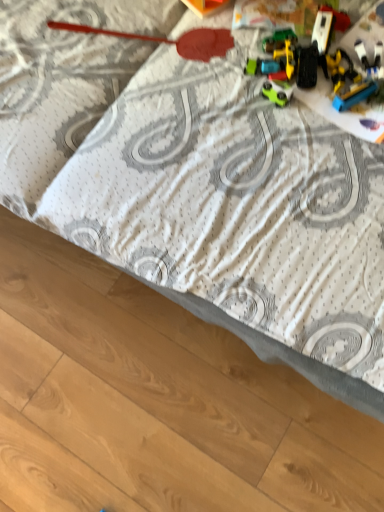
Question: From a real-world perspective, does green matte car at center, the second toy positioned from the left, stand above yellow plastic toy truck at upper right, which is counted as the 4th toy, starting from the left?

Choices:
 (A) yes
 (B) no

Answer: (A)

Question: Considering the relative sizes of green matte car at center, the second toy positioned from the left, and yellow plastic toy truck at upper right, which is counted as the 4th toy, starting from the left, in the image provided, is green matte car at center, the second toy positioned from the left, thinner than yellow plastic toy truck at upper right, which is counted as the 4th toy, starting from the left,?

Choices:
 (A) no
 (B) yes

Answer: (B)

Question: Is yellow plastic toy truck at upper right, which is counted as the 4th toy, starting from the left, at the back of green matte car at center, the second toy positioned from the left?

Choices:
 (A) no
 (B) yes

Answer: (A)

Question: Does green matte car at center, the second toy positioned from the left, have a lesser height compared to yellow plastic toy truck at upper right, which is counted as the 4th toy, starting from the left?

Choices:
 (A) yes
 (B) no

Answer: (A)

Question: Does green matte car at center, placed as the third toy when sorted from right to left, turn towards yellow plastic toy truck at upper right, which is the first toy in right-to-left order?

Choices:
 (A) no
 (B) yes

Answer: (A)

Question: Are green matte car at center, placed as the third toy when sorted from right to left, and yellow plastic toy truck at upper right, which is counted as the 4th toy, starting from the left, located far from each other?

Choices:
 (A) yes
 (B) no

Answer: (B)

Question: Is metallic red spatula at upper center, the 4th toy when ordered from right to left, at the back of green matte car at center, the second toy positioned from the left?

Choices:
 (A) no
 (B) yes

Answer: (A)

Question: Does green matte car at center, the second toy positioned from the left, come behind metallic red spatula at upper center, the 4th toy when ordered from right to left?

Choices:
 (A) yes
 (B) no

Answer: (B)

Question: Can you confirm if green matte car at center, the second toy positioned from the left, is thinner than metallic red spatula at upper center, positioned as the 1th toy in left-to-right order?

Choices:
 (A) no
 (B) yes

Answer: (B)

Question: Is green matte car at center, placed as the third toy when sorted from right to left, at the right side of metallic red spatula at upper center, positioned as the 1th toy in left-to-right order?

Choices:
 (A) yes
 (B) no

Answer: (A)

Question: Does green matte car at center, the second toy positioned from the left, appear on the left side of metallic red spatula at upper center, positioned as the 1th toy in left-to-right order?

Choices:
 (A) yes
 (B) no

Answer: (B)

Question: From the image's perspective, is green matte car at center, the second toy positioned from the left, on metallic red spatula at upper center, positioned as the 1th toy in left-to-right order?

Choices:
 (A) yes
 (B) no

Answer: (B)

Question: Can you confirm if yellow plastic toy truck at upper right, which is counted as the 4th toy, starting from the left, is bigger than metallic red spatula at upper center, positioned as the 1th toy in left-to-right order?

Choices:
 (A) yes
 (B) no

Answer: (B)